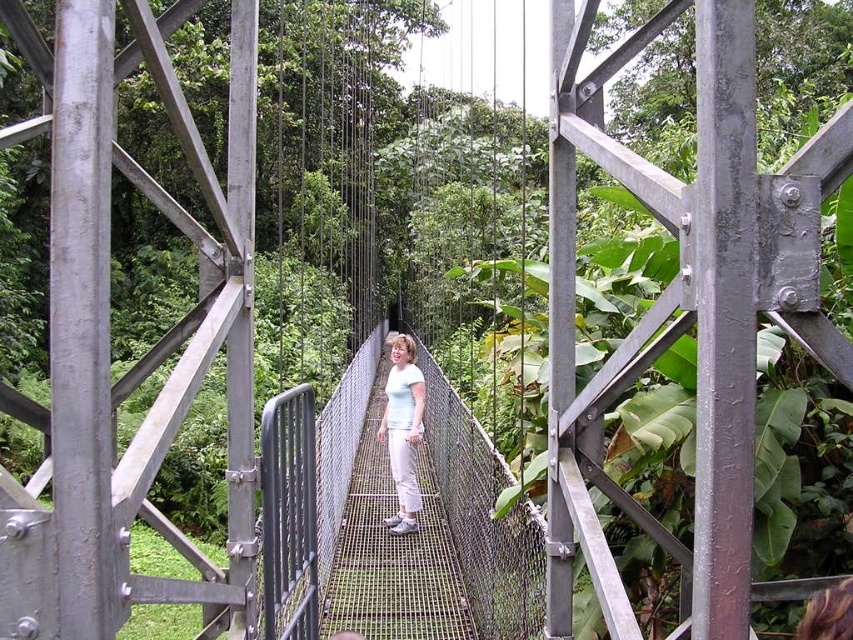
Which is behind, point (497, 609) or point (402, 480)?

Positioned behind is point (402, 480).

Is metal mesh rope bridge at center above white matte pants at center?

No, metal mesh rope bridge at center is not above white matte pants at center.

Who is more distant from viewer, (500, 588) or (398, 340)?

Point (398, 340)

Identify the location of metal mesh rope bridge at center. (405, 536).